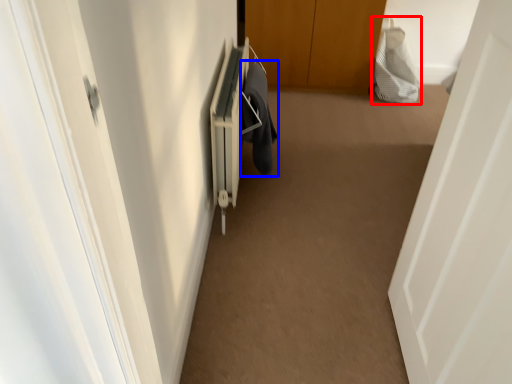
Question: Among these objects, which one is farthest to the camera, material (highlighted by a red box) or laundry (highlighted by a blue box)?

Choices:
 (A) material
 (B) laundry

Answer: (A)